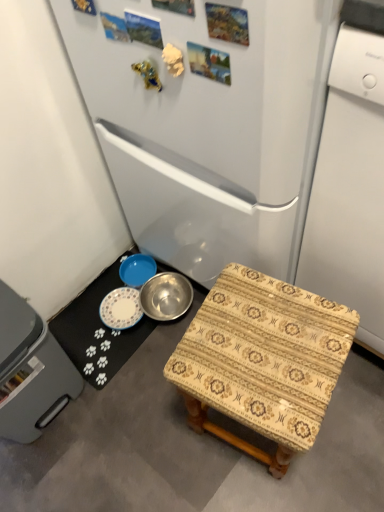
Question: Does white glossy dishwasher at right have a lesser width compared to patterned fabric stool at lower right?

Choices:
 (A) no
 (B) yes

Answer: (A)

Question: Is white glossy dishwasher at right smaller than patterned fabric stool at lower right?

Choices:
 (A) yes
 (B) no

Answer: (B)

Question: Is white glossy dishwasher at right wider than patterned fabric stool at lower right?

Choices:
 (A) no
 (B) yes

Answer: (B)

Question: Is white glossy dishwasher at right positioned with its back to patterned fabric stool at lower right?

Choices:
 (A) no
 (B) yes

Answer: (A)

Question: Would you consider white glossy dishwasher at right to be distant from patterned fabric stool at lower right?

Choices:
 (A) yes
 (B) no

Answer: (B)

Question: From the image's perspective, is white glossy dishwasher at right under patterned fabric stool at lower right?

Choices:
 (A) no
 (B) yes

Answer: (A)

Question: Is metallic silver bowl at lower center positioned before white glossy refrigerator at center?

Choices:
 (A) yes
 (B) no

Answer: (B)

Question: Is metallic silver bowl at lower center surrounding white glossy refrigerator at center?

Choices:
 (A) yes
 (B) no

Answer: (B)

Question: Considering the relative sizes of metallic silver bowl at lower center and white glossy refrigerator at center in the image provided, is metallic silver bowl at lower center thinner than white glossy refrigerator at center?

Choices:
 (A) yes
 (B) no

Answer: (A)

Question: Does metallic silver bowl at lower center lie behind white glossy refrigerator at center?

Choices:
 (A) yes
 (B) no

Answer: (A)

Question: Considering the relative sizes of metallic silver bowl at lower center and white glossy refrigerator at center in the image provided, is metallic silver bowl at lower center shorter than white glossy refrigerator at center?

Choices:
 (A) yes
 (B) no

Answer: (A)

Question: From the image's perspective, is metallic silver bowl at lower center located beneath white glossy refrigerator at center?

Choices:
 (A) no
 (B) yes

Answer: (B)

Question: Is metallic silver bowl at lower center facing towards gray plastic dishwasher at lower left?

Choices:
 (A) no
 (B) yes

Answer: (A)